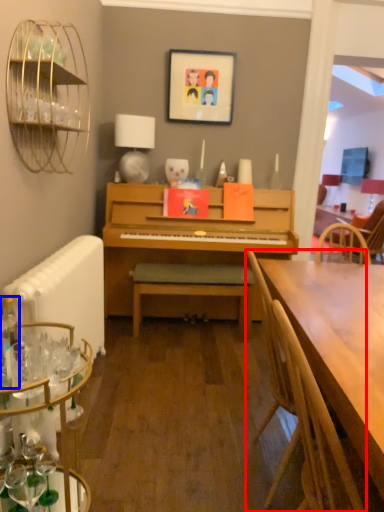
Question: Which object appears farthest to the camera in this image, chair (highlighted by a red box) or bottle (highlighted by a blue box)?

Choices:
 (A) chair
 (B) bottle

Answer: (B)